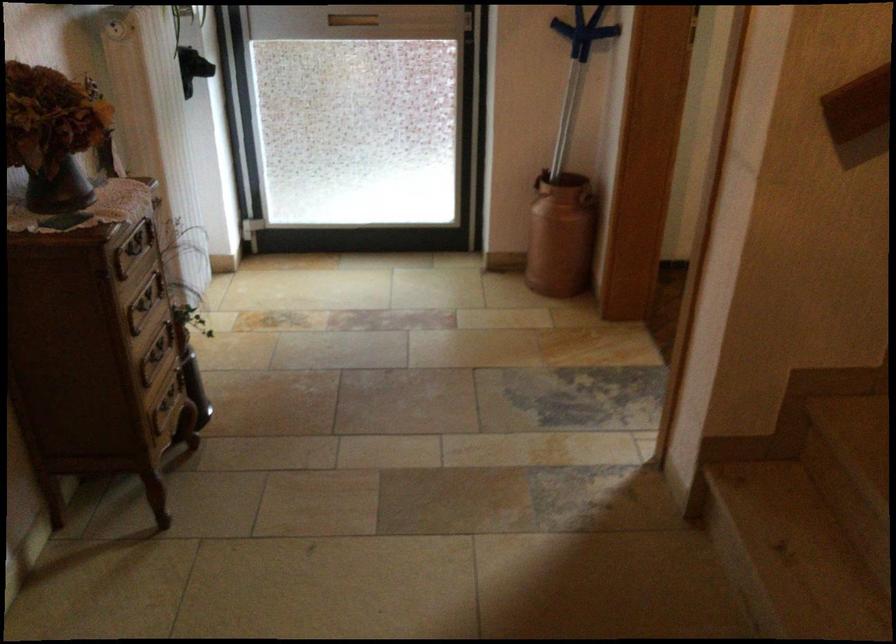
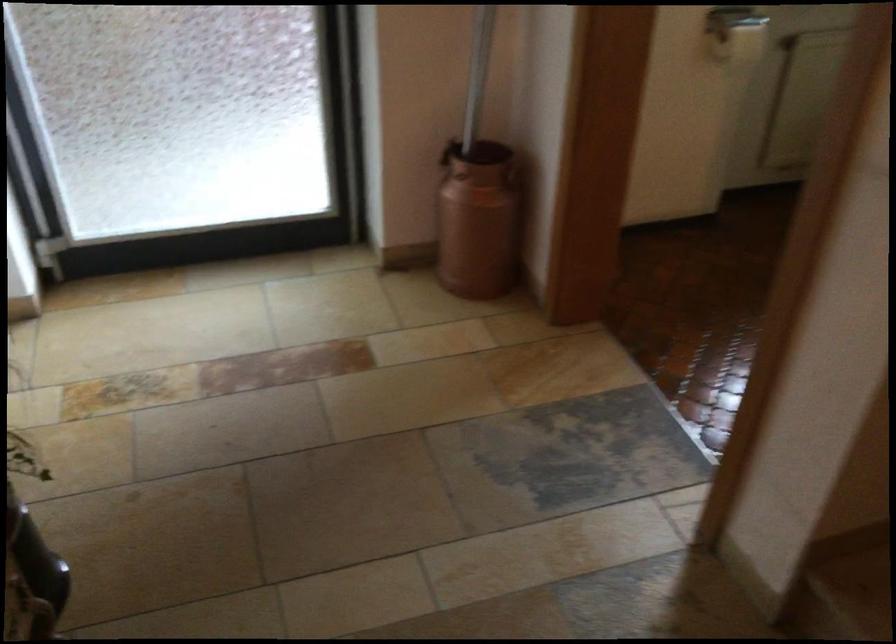
The images are taken continuously from a first-person perspective. In which direction are you moving?

The cameraman moved toward left, forward.